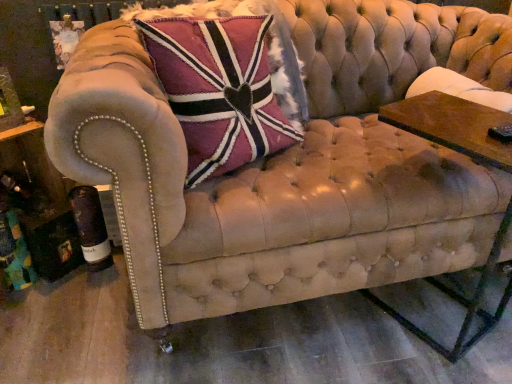
This screenshot has width=512, height=384. What do you see at coordinates (220, 89) in the screenshot? I see `velvet union jack pillow at upper left` at bounding box center [220, 89].

Where is `velvet union jack pillow at upper left`? The image size is (512, 384). velvet union jack pillow at upper left is located at coordinates (220, 89).

This screenshot has width=512, height=384. What do you see at coordinates (455, 126) in the screenshot?
I see `wooden rectangular table at right` at bounding box center [455, 126].

This screenshot has height=384, width=512. I want to click on wooden rectangular table at right, so click(455, 126).

You are a GUI agent. You are given a task and a screenshot of the screen. Output one action in this format:
    pyautogui.click(x=<x>, y=<y>)
    Task: Click on the velvet union jack pillow at upper left
    The image size is (512, 384).
    Given the screenshot: What is the action you would take?
    pyautogui.click(x=220, y=89)

Which object is positioned more to the left, wooden rectangular table at right or velvet union jack pillow at upper left?

velvet union jack pillow at upper left.

Is wooden rectangular table at right positioned behind velvet union jack pillow at upper left?

No, it is not.

Does point (478, 153) lie behind point (241, 31)?

That is False.

From the image's perspective, is wooden rectangular table at right located above velvet union jack pillow at upper left?

No, from the image's perspective, wooden rectangular table at right is not above velvet union jack pillow at upper left.

Based on the photo, from a real-world perspective, is wooden rectangular table at right on top of velvet union jack pillow at upper left?

No.

Which object is wider, wooden rectangular table at right or velvet union jack pillow at upper left?

wooden rectangular table at right.

Considering the relative sizes of wooden rectangular table at right and velvet union jack pillow at upper left in the image provided, is wooden rectangular table at right shorter than velvet union jack pillow at upper left?

No.

Is wooden rectangular table at right smaller than velvet union jack pillow at upper left?

Correct, wooden rectangular table at right occupies less space than velvet union jack pillow at upper left.

Would you say wooden rectangular table at right contains velvet union jack pillow at upper left?

No, wooden rectangular table at right does not contain velvet union jack pillow at upper left.

Is wooden rectangular table at right placed right next to velvet union jack pillow at upper left?

No, wooden rectangular table at right is not in contact with velvet union jack pillow at upper left.

Is wooden rectangular table at right aimed at velvet union jack pillow at upper left?

No.

In the scene shown: Can you tell me how much wooden rectangular table at right and velvet union jack pillow at upper left differ in facing direction?

161 degrees.

Where is `throw pillow that is on the left side of wooden rectangular table at right`? throw pillow that is on the left side of wooden rectangular table at right is located at coordinates (220, 89).

Considering the relative positions of velvet union jack pillow at upper left and wooden rectangular table at right in the image provided, is velvet union jack pillow at upper left to the right of wooden rectangular table at right from the viewer's perspective?

In fact, velvet union jack pillow at upper left is to the left of wooden rectangular table at right.

Considering their positions, is velvet union jack pillow at upper left located in front of or behind wooden rectangular table at right?

In the image, velvet union jack pillow at upper left appears behind wooden rectangular table at right.

Considering the positions of points (261, 110) and (469, 135), is point (261, 110) closer to camera compared to point (469, 135)?

No, it is behind (469, 135).

From the image's perspective, is velvet union jack pillow at upper left above or below wooden rectangular table at right?

velvet union jack pillow at upper left is situated higher than wooden rectangular table at right in the image.

From a real-world perspective, who is located higher, velvet union jack pillow at upper left or wooden rectangular table at right?

From a 3D spatial view, velvet union jack pillow at upper left is above.

Can you confirm if velvet union jack pillow at upper left is wider than wooden rectangular table at right?

No.

Considering the relative sizes of velvet union jack pillow at upper left and wooden rectangular table at right in the image provided, is velvet union jack pillow at upper left taller than wooden rectangular table at right?

No.

Does velvet union jack pillow at upper left have a smaller size compared to wooden rectangular table at right?

No.

Can we say velvet union jack pillow at upper left lies outside wooden rectangular table at right?

Yes, velvet union jack pillow at upper left is outside of wooden rectangular table at right.

Are velvet union jack pillow at upper left and wooden rectangular table at right far apart?

That's not correct — velvet union jack pillow at upper left is a little close to wooden rectangular table at right.

Is velvet union jack pillow at upper left turned away from wooden rectangular table at right?

No, velvet union jack pillow at upper left's orientation is not away from wooden rectangular table at right.

How different are the orientations of velvet union jack pillow at upper left and wooden rectangular table at right in degrees?

They differ by 161 degrees in their facing directions.

How far apart are velvet union jack pillow at upper left and wooden rectangular table at right?

velvet union jack pillow at upper left and wooden rectangular table at right are 18.38 inches apart.

In order to click on side table on the right of velvet union jack pillow at upper left in this screenshot , I will do `click(455, 126)`.

This screenshot has height=384, width=512. In order to click on side table on the right side of velvet union jack pillow at upper left in this screenshot , I will do `click(455, 126)`.

The width and height of the screenshot is (512, 384). Find the location of `side table below the velvet union jack pillow at upper left (from a real-world perspective)`. side table below the velvet union jack pillow at upper left (from a real-world perspective) is located at coordinates (455, 126).